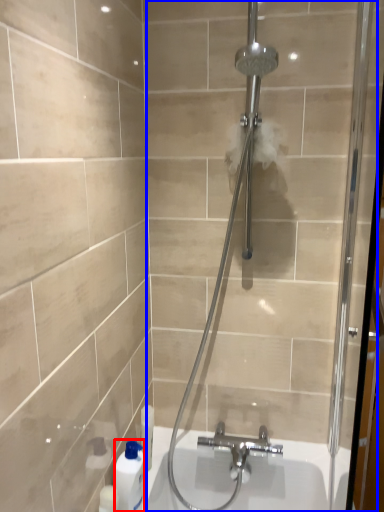
Question: Which point is further to the camera, cleaning product (highlighted by a red box) or shower door (highlighted by a blue box)?

Choices:
 (A) cleaning product
 (B) shower door

Answer: (A)